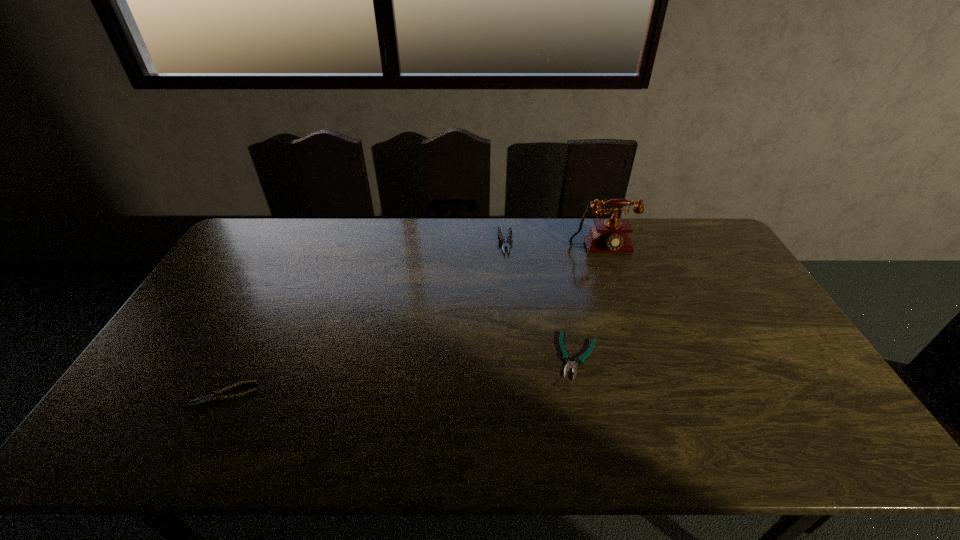
I want to click on vacant position located on the left of the second farthest pliers, so click(x=476, y=356).

This screenshot has width=960, height=540. Find the location of `telephone that is positioned at the far edge`. telephone that is positioned at the far edge is located at coordinates (611, 235).

The height and width of the screenshot is (540, 960). Find the location of `pliers positioned at the far edge`. pliers positioned at the far edge is located at coordinates (509, 241).

Locate an element on the screen. object that is at the left edge is located at coordinates (215, 397).

This screenshot has width=960, height=540. In the image, there is a desktop. What are the coordinates of `vacant space at the far edge` in the screenshot? It's located at (573, 227).

Where is `vacant space at the near edge`? The width and height of the screenshot is (960, 540). vacant space at the near edge is located at coordinates (551, 446).

Locate an element on the screen. blank area at the left edge is located at coordinates (205, 323).

In the image, there is a desktop. Where is `free space at the right edge`? free space at the right edge is located at coordinates tap(750, 357).

The image size is (960, 540). Find the location of `vacant point at the far right corner`. vacant point at the far right corner is located at coordinates (688, 220).

In the image, there is a desktop. Where is `vacant area at the near right corner`? vacant area at the near right corner is located at coordinates (799, 440).